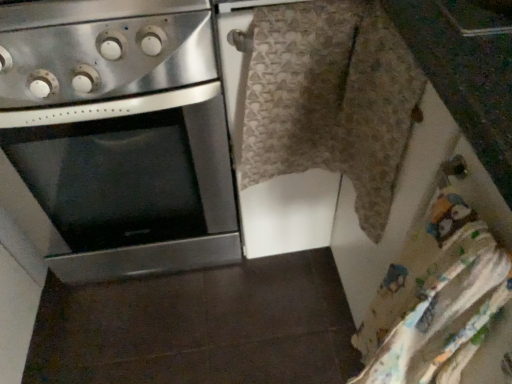
Question: Does stainless steel oven at left have a larger size compared to textured beige blanket at center?

Choices:
 (A) yes
 (B) no

Answer: (A)

Question: Is stainless steel oven at left positioned beyond the bounds of textured beige blanket at center?

Choices:
 (A) no
 (B) yes

Answer: (B)

Question: Can you confirm if stainless steel oven at left is positioned to the right of textured beige blanket at center?

Choices:
 (A) yes
 (B) no

Answer: (B)

Question: From a real-world perspective, is stainless steel oven at left on textured beige blanket at center?

Choices:
 (A) yes
 (B) no

Answer: (B)

Question: From the image's perspective, is stainless steel oven at left beneath textured beige blanket at center?

Choices:
 (A) no
 (B) yes

Answer: (A)

Question: Is stainless steel oven at left wider than textured beige blanket at center?

Choices:
 (A) no
 (B) yes

Answer: (B)

Question: Is stainless steel gas stove at upper left far away from textured beige blanket at center?

Choices:
 (A) no
 (B) yes

Answer: (A)

Question: Is stainless steel gas stove at upper left facing towards textured beige blanket at center?

Choices:
 (A) no
 (B) yes

Answer: (A)

Question: Does stainless steel gas stove at upper left have a lesser width compared to textured beige blanket at center?

Choices:
 (A) no
 (B) yes

Answer: (A)

Question: Is stainless steel gas stove at upper left next to textured beige blanket at center and touching it?

Choices:
 (A) yes
 (B) no

Answer: (B)

Question: Considering the relative sizes of stainless steel gas stove at upper left and textured beige blanket at center in the image provided, is stainless steel gas stove at upper left shorter than textured beige blanket at center?

Choices:
 (A) no
 (B) yes

Answer: (B)

Question: Does stainless steel gas stove at upper left have a smaller size compared to textured beige blanket at center?

Choices:
 (A) no
 (B) yes

Answer: (A)

Question: Is textured beige blanket at center oriented towards stainless steel oven at left?

Choices:
 (A) no
 (B) yes

Answer: (A)